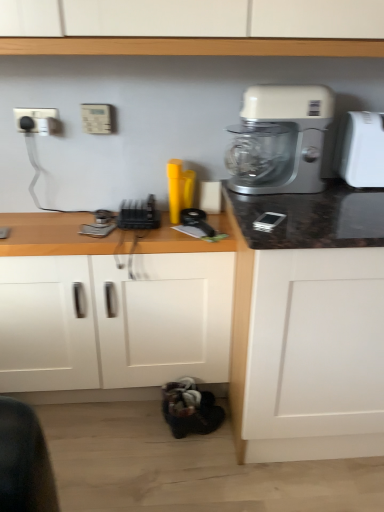
Question: Considering the positions of white plastic electric outlet at upper left, the 1th electric outlet when ordered from left to right, and wooden at lower left in the image, is white plastic electric outlet at upper left, the 1th electric outlet when ordered from left to right, wider or thinner than wooden at lower left?

Choices:
 (A) wide
 (B) thin

Answer: (B)

Question: Considering the positions of white plastic electric outlet at upper left, the 1th electric outlet when ordered from left to right, and wooden at lower left in the image, is white plastic electric outlet at upper left, the 1th electric outlet when ordered from left to right, bigger or smaller than wooden at lower left?

Choices:
 (A) small
 (B) big

Answer: (A)

Question: Considering the real-world distances, which object is closest to the wooden at lower left?

Choices:
 (A) beige plastic electric outlet at upper center, the first electric outlet when ordered from right to left
 (B) white plastic electric outlet at upper left, the 1th electric outlet when ordered from left to right
 (C) black plastic toaster at center
 (D) white plastic mixer at upper right
 (E) white plastic toaster at right

Answer: (C)

Question: Which is farther from the wooden at lower left?

Choices:
 (A) white plastic mixer at upper right
 (B) black plastic toaster at center
 (C) beige plastic electric outlet at upper center, which is counted as the second electric outlet, starting from the left
 (D) white plastic toaster at right
 (E) white plastic electric outlet at upper left, the 1th electric outlet when ordered from left to right

Answer: (D)